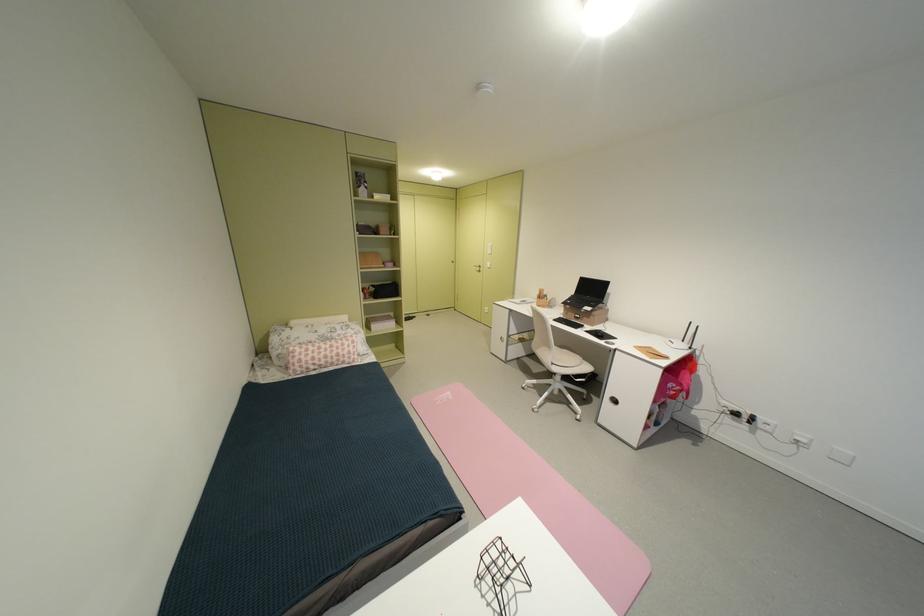
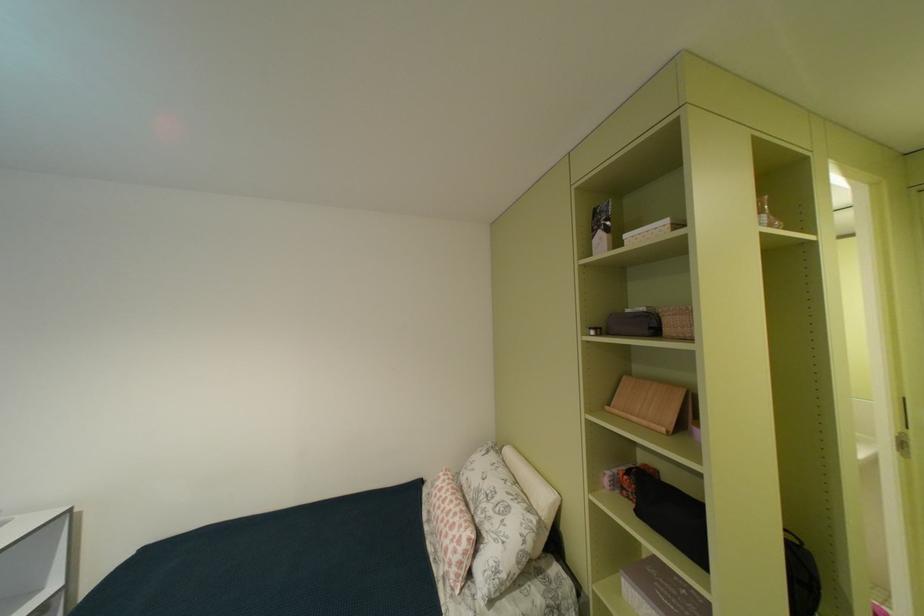
Locate, in the second image, the point that corresponds to pixel 391 233 in the first image.

(675, 331)